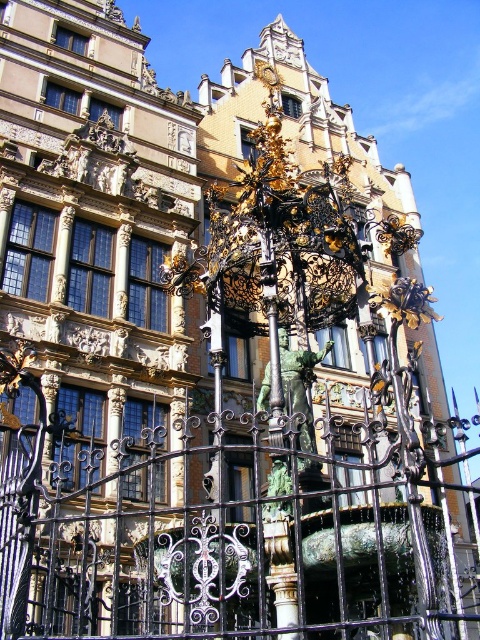
Does black wrought iron fence at center have a larger size compared to green patina statue at center?

Indeed, black wrought iron fence at center has a larger size compared to green patina statue at center.

The height and width of the screenshot is (640, 480). Describe the element at coordinates (241, 531) in the screenshot. I see `black wrought iron fence at center` at that location.

Based on the photo, measure the distance between black wrought iron fence at center and camera.

21.59 meters

Where is `black wrought iron fence at center`? This screenshot has width=480, height=640. black wrought iron fence at center is located at coordinates (241, 531).